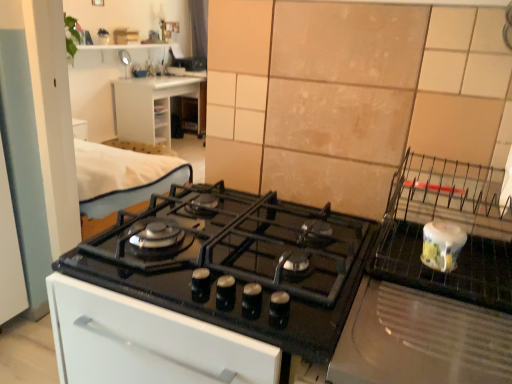
Question: From the image's perspective, is beige tile at upper right over white ceramic jar at right?

Choices:
 (A) no
 (B) yes

Answer: (B)

Question: Can you confirm if beige tile at upper right is bigger than white ceramic jar at right?

Choices:
 (A) no
 (B) yes

Answer: (A)

Question: Can you confirm if beige tile at upper right is smaller than white ceramic jar at right?

Choices:
 (A) no
 (B) yes

Answer: (B)

Question: Is beige tile at upper right far from white ceramic jar at right?

Choices:
 (A) yes
 (B) no

Answer: (B)

Question: Is beige tile at upper right next to white ceramic jar at right?

Choices:
 (A) yes
 (B) no

Answer: (B)

Question: Considering their positions, is white ceramic jar at right located in front of or behind black glass gas stove at center?

Choices:
 (A) front
 (B) behind

Answer: (A)

Question: Would you say white ceramic jar at right is to the left or to the right of black glass gas stove at center in the picture?

Choices:
 (A) left
 (B) right

Answer: (B)

Question: From the image's perspective, is white ceramic jar at right located above or below black glass gas stove at center?

Choices:
 (A) below
 (B) above

Answer: (A)

Question: Would you say white ceramic jar at right is inside or outside black glass gas stove at center?

Choices:
 (A) outside
 (B) inside

Answer: (A)

Question: In the image, is white plastic drawer at upper left on the left side or the right side of black glass gas stove at center?

Choices:
 (A) left
 (B) right

Answer: (A)

Question: From the image's perspective, is white plastic drawer at upper left located above or below black glass gas stove at center?

Choices:
 (A) above
 (B) below

Answer: (A)

Question: Considering the positions of white plastic drawer at upper left and black glass gas stove at center in the image, is white plastic drawer at upper left bigger or smaller than black glass gas stove at center?

Choices:
 (A) big
 (B) small

Answer: (A)

Question: In terms of height, does white plastic drawer at upper left look taller or shorter compared to black glass gas stove at center?

Choices:
 (A) short
 (B) tall

Answer: (B)

Question: Considering the positions of white ceramic jar at right and beige tile at upper right in the image, is white ceramic jar at right taller or shorter than beige tile at upper right?

Choices:
 (A) short
 (B) tall

Answer: (A)

Question: Would you say white ceramic jar at right is inside or outside beige tile at upper right?

Choices:
 (A) outside
 (B) inside

Answer: (A)